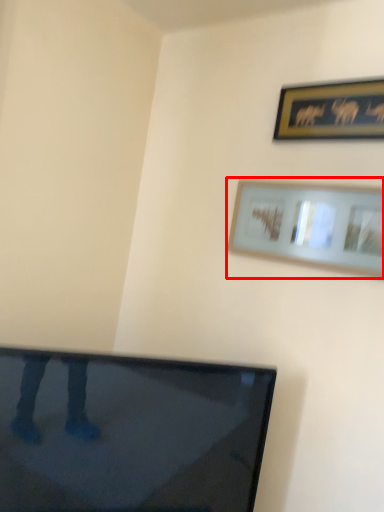
Question: Observing the image, what is the correct spatial positioning of picture frame (annotated by the red box) in reference to picture frame?

Choices:
 (A) right
 (B) left

Answer: (B)